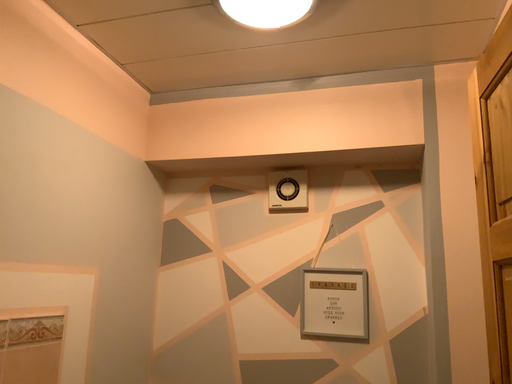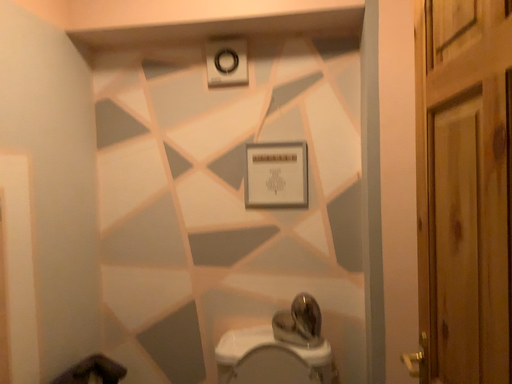
Question: How did the camera likely rotate when shooting the video?

Choices:
 (A) rotated right
 (B) rotated left

Answer: (A)